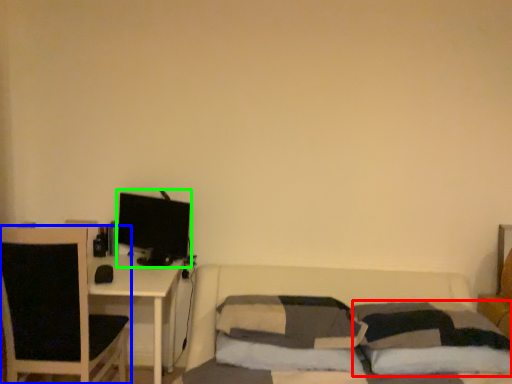
Question: Which object is the farthest from pillow (highlighted by a red box)? Choose among these: chair (highlighted by a blue box) or computer monitor (highlighted by a green box).

Choices:
 (A) chair
 (B) computer monitor

Answer: (A)